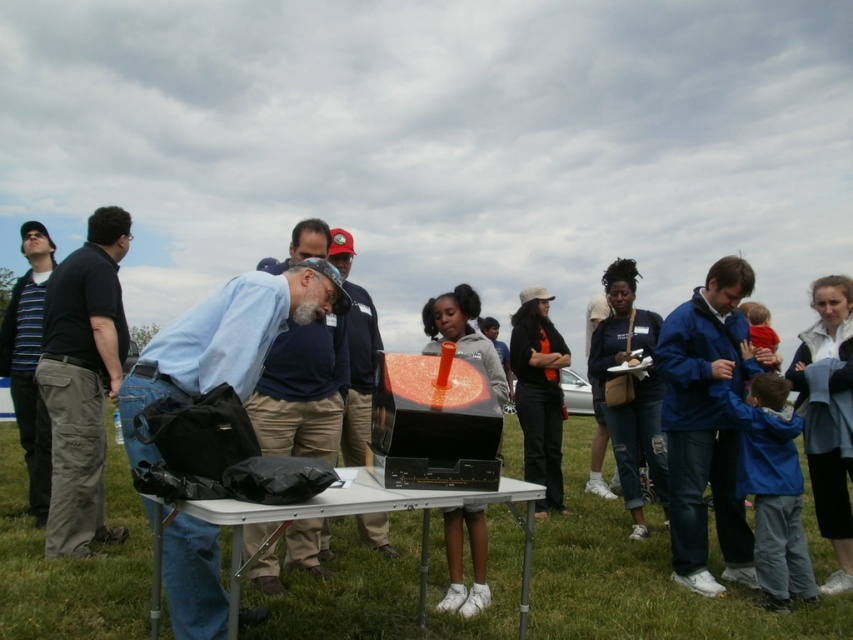
What do you see at coordinates (227, 337) in the screenshot? The image size is (853, 640). I see `blue fabric shirt at center` at bounding box center [227, 337].

Where is `blue fabric shirt at center`? blue fabric shirt at center is located at coordinates (227, 337).

Identify the location of blue fabric shirt at center. (227, 337).

Looking at this image, between dark gray pants at left and striped knit sweater at left, which one appears on the right side from the viewer's perspective?

dark gray pants at left is more to the right.

Does dark gray pants at left lie behind striped knit sweater at left?

No, dark gray pants at left is in front of striped knit sweater at left.

Is point (114, 540) positioned before point (28, 444)?

Yes, it is in front of point (28, 444).

At what (x,y) coordinates should I click in order to perform the action: click on dark gray pants at left. Please return your answer as a coordinate pair (x, y). This screenshot has height=640, width=853. Looking at the image, I should click on (82, 381).

Between point (248, 324) and point (738, 540), which one is positioned behind?

Point (738, 540)

Which is above, blue fabric shirt at center or blue fabric jacket at right?

Positioned higher is blue fabric shirt at center.

What do you see at coordinates (227, 337) in the screenshot?
I see `blue fabric shirt at center` at bounding box center [227, 337].

Find the location of `blue fabric shirt at center`. blue fabric shirt at center is located at coordinates (227, 337).